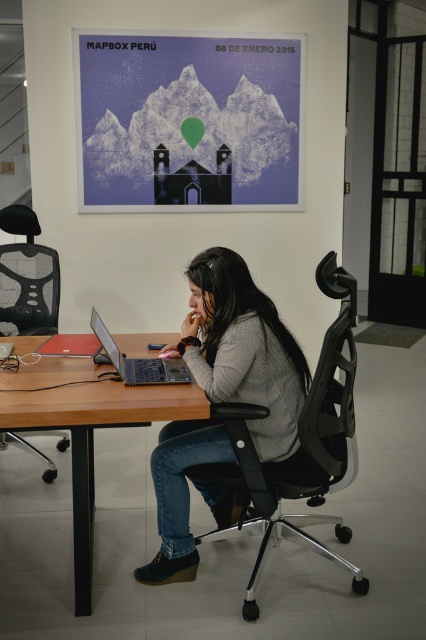
Question: Is the position of gray sweater at center less distant than that of black mesh swivel chair at left?

Choices:
 (A) no
 (B) yes

Answer: (B)

Question: Which of the following is the closest to the observer?

Choices:
 (A) (209, 104)
 (B) (97, 396)

Answer: (B)

Question: From the image, what is the correct spatial relationship of gray sweater at center in relation to wooden table at center?

Choices:
 (A) below
 (B) above

Answer: (B)

Question: Which object is farther from the camera taking this photo?

Choices:
 (A) black mesh office chair at center
 (B) wooden table at center
 (C) matte paper poster at upper center

Answer: (C)

Question: Can you confirm if matte paper poster at upper center is positioned above black mesh swivel chair at left?

Choices:
 (A) no
 (B) yes

Answer: (B)

Question: Estimate the real-world distances between objects in this image. Which object is closer to the gray sweater at center?

Choices:
 (A) black mesh office chair at center
 (B) matte black laptop at center
 (C) matte paper poster at upper center
 (D) black mesh swivel chair at left

Answer: (A)